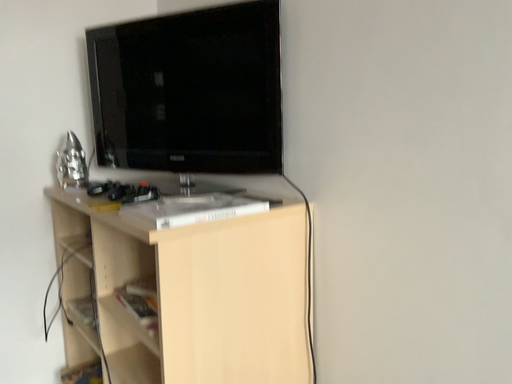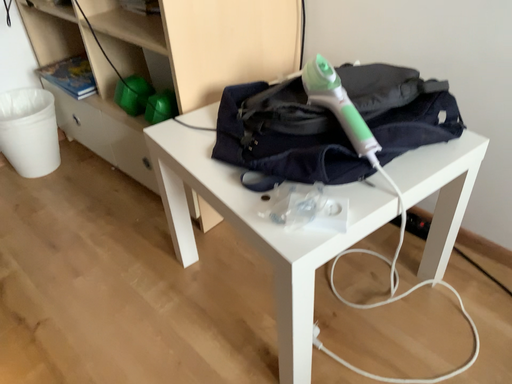
Question: Which way did the camera rotate in the video?

Choices:
 (A) rotated upward
 (B) rotated downward

Answer: (B)